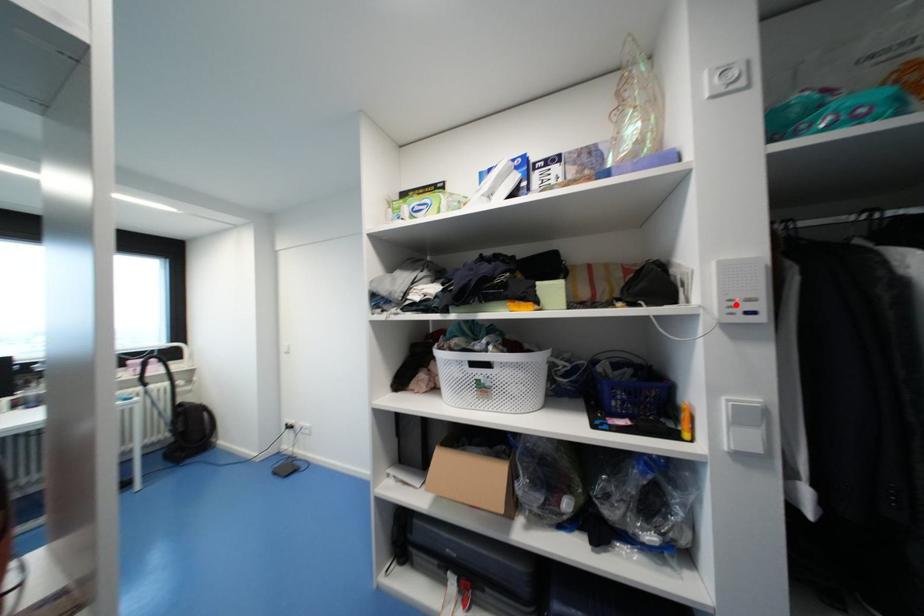
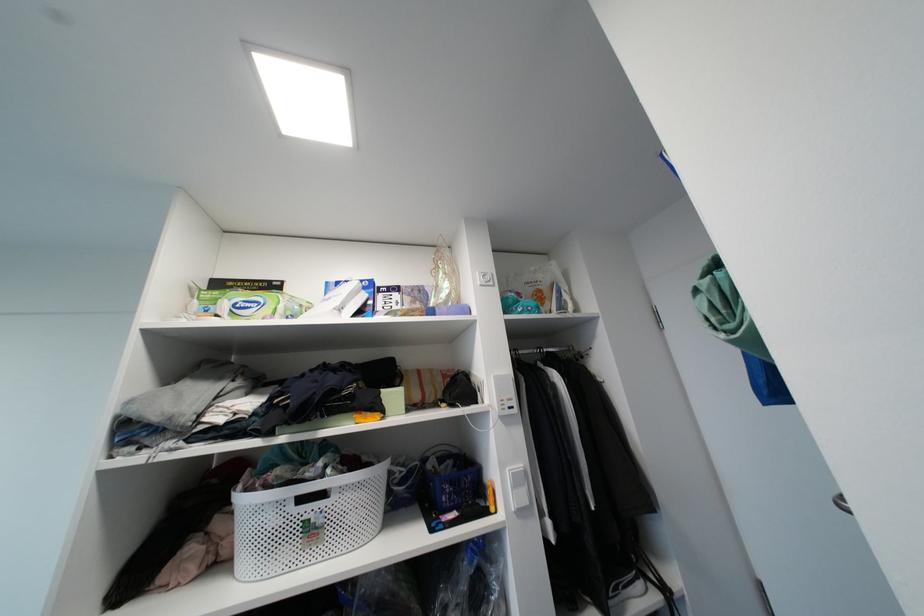
Question: I am providing you with two images of the same scene from different viewpoints. Given a red point in image1, look at the same physical point in image2. Is it:

Choices:
 (A) Closer to the viewpoint
 (B) Farther from the viewpoint

Answer: (B)